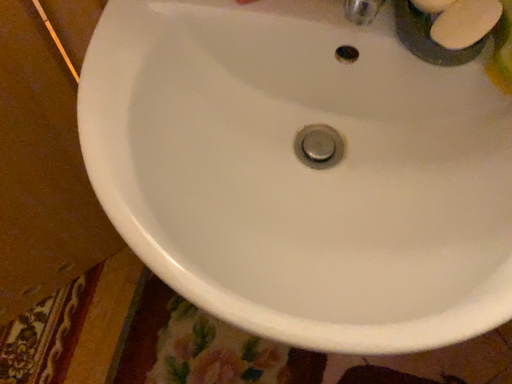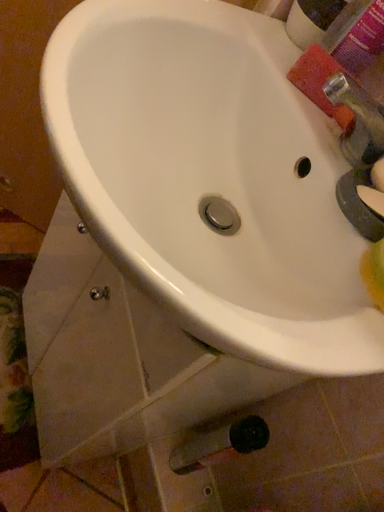
Question: How did the camera likely rotate when shooting the video?

Choices:
 (A) rotated downward
 (B) rotated upward

Answer: (B)